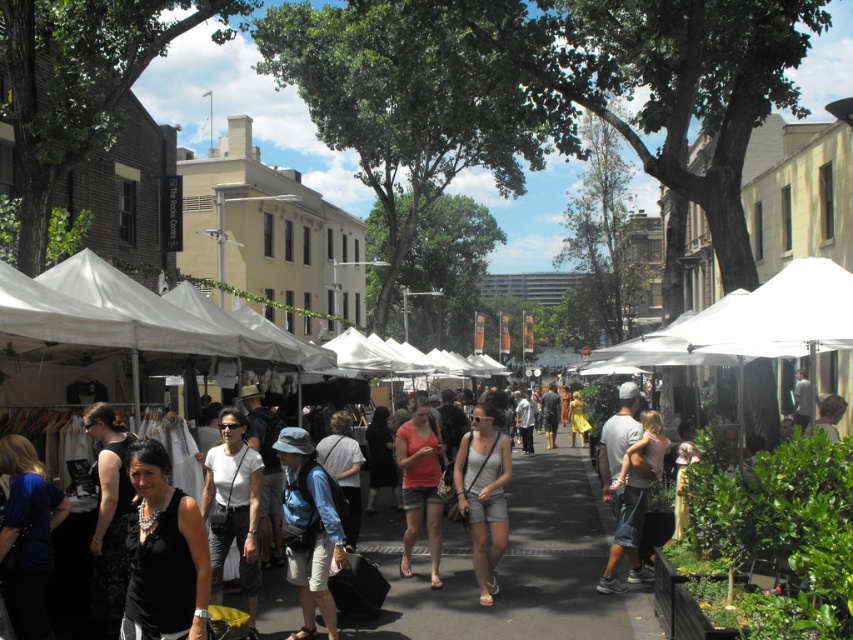
Question: Which point is closer to the camera?

Choices:
 (A) (801, 440)
 (B) (245, 522)

Answer: (A)

Question: Does blue denim shorts at center appear over matte pink shirt at center?

Choices:
 (A) yes
 (B) no

Answer: (A)

Question: Does black fabric at center have a smaller size compared to light gray denim shorts at center?

Choices:
 (A) yes
 (B) no

Answer: (A)

Question: Among these points, which one is farthest from the camera?

Choices:
 (A) (437, 465)
 (B) (291, 582)
 (C) (241, 531)
 (D) (467, 433)

Answer: (D)

Question: Estimate the real-world distances between objects in this image. Which object is closer to the light gray denim shorts at center?

Choices:
 (A) white matte shirt at center
 (B) matte pink shirt at center
 (C) black fabric at center

Answer: (B)

Question: Is white matte shirt at center in front of matte pink shirt at center?

Choices:
 (A) yes
 (B) no

Answer: (A)